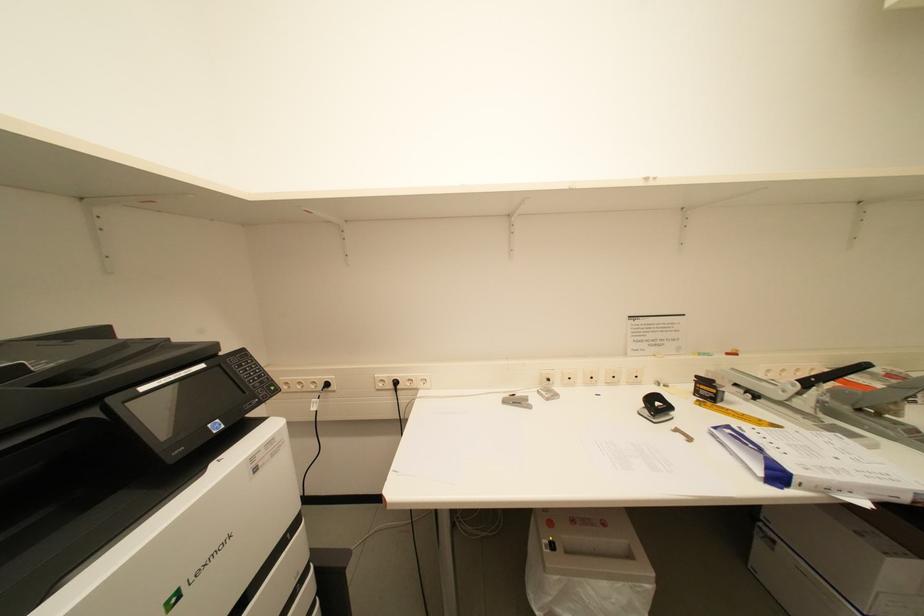
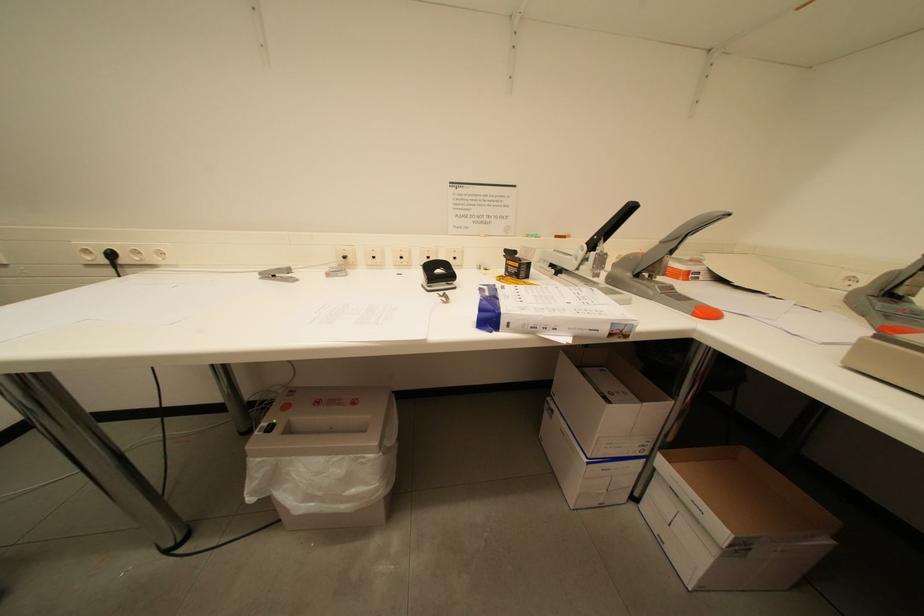
Question: What movement of the cameraman would produce the second image?

Choices:
 (A) Left
 (B) Right
 (C) Forward
 (D) Backward

Answer: (B)